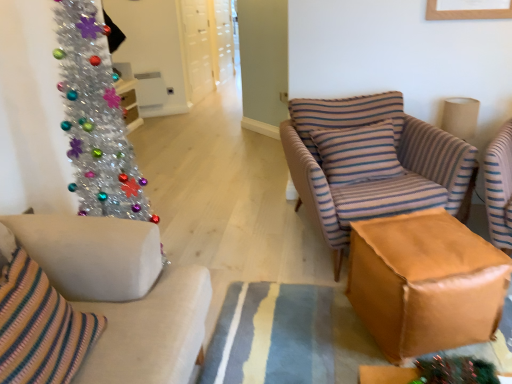
This screenshot has width=512, height=384. What do you see at coordinates (122, 294) in the screenshot?
I see `white fabric couch at left` at bounding box center [122, 294].

This screenshot has width=512, height=384. What are the coordinates of `white fabric couch at left` in the screenshot? It's located at (122, 294).

In order to face brown leather ottoman at center, should I rotate leftwards or rightwards?

Turn right by 20.849 degrees to look at brown leather ottoman at center.

Describe the element at coordinates (358, 153) in the screenshot. I see `striped fabric pillow at center` at that location.

Find the location of a particular element. striped fabric armchair at center is located at coordinates (372, 163).

This screenshot has width=512, height=384. In order to click on white fabric couch at left in this screenshot , I will do `click(122, 294)`.

Which of these two, striped fabric armchair at center or shiny metallic christmas tree at left, is bigger?

With larger size is striped fabric armchair at center.

Where is `rocking chair below the shiny metallic christmas tree at left (from the image's perspective)`? Image resolution: width=512 pixels, height=384 pixels. rocking chair below the shiny metallic christmas tree at left (from the image's perspective) is located at coordinates (372, 163).

Relative to shiny metallic christmas tree at left, is striped fabric armchair at center in front or behind?

striped fabric armchair at center is behind shiny metallic christmas tree at left.

Is striped fabric armchair at center to the left or to the right of shiny metallic christmas tree at left in the image?

Based on their positions, striped fabric armchair at center is located to the right of shiny metallic christmas tree at left.

Is striped fabric pillow at center at the right side of striped fabric armchair at center?

No.

From a real-world perspective, which object stands above the other?

In real-world perspective, striped fabric pillow at center is above.

How distant is striped fabric pillow at center from striped fabric armchair at center?

striped fabric pillow at center is 3.70 inches away from striped fabric armchair at center.

Which point is more distant from viewer, (x=393, y=166) or (x=444, y=145)?

Point (x=393, y=166)

From their relative heights in the image, would you say shiny metallic christmas tree at left is taller or shorter than striped fabric pillow at center?

In the image, shiny metallic christmas tree at left appears to be taller than striped fabric pillow at center.

Considering the positions of objects shiny metallic christmas tree at left and striped fabric pillow at center in the image provided, who is behind, shiny metallic christmas tree at left or striped fabric pillow at center?

Positioned behind is striped fabric pillow at center.

Find the location of a particular element. Image resolution: width=512 pixels, height=384 pixels. christmas tree positioned vertically above the striped fabric pillow at center (from a real-world perspective) is located at coordinates (96, 119).

From the image's perspective, is shiny metallic christmas tree at left below striped fabric pillow at center?

Yes, from the image's perspective, shiny metallic christmas tree at left is below striped fabric pillow at center.

Which object is further away from the camera taking this photo, white fabric couch at left or shiny metallic christmas tree at left?

shiny metallic christmas tree at left is further from the camera.

Would you say shiny metallic christmas tree at left is part of white fabric couch at left's contents?

That's incorrect, shiny metallic christmas tree at left is not inside white fabric couch at left.

From the image's perspective, would you say white fabric couch at left is shown under shiny metallic christmas tree at left?

Correct, white fabric couch at left appears lower than shiny metallic christmas tree at left in the image.

From a real-world perspective, does white fabric couch at left stand above shiny metallic christmas tree at left?

No, from a real-world perspective, white fabric couch at left is not on top of shiny metallic christmas tree at left.

Is white fabric couch at left outside of striped fabric pillow at center?

Absolutely, white fabric couch at left is external to striped fabric pillow at center.

From the picture: Is white fabric couch at left not near striped fabric pillow at center?

white fabric couch at left is far away from striped fabric pillow at center.

Considering the sizes of objects white fabric couch at left and striped fabric pillow at center in the image provided, who is bigger, white fabric couch at left or striped fabric pillow at center?

With larger size is white fabric couch at left.

How different are the orientations of white fabric couch at left and striped fabric pillow at center in degrees?

74.5 degrees.

Is point (100, 223) positioned in front of point (430, 221)?

That is True.

Can you confirm if white fabric couch at left is positioned to the left of brown leather ottoman at center?

Yes.

From the picture: How distant is white fabric couch at left from brown leather ottoman at center?

white fabric couch at left is 89.42 centimeters from brown leather ottoman at center.

Is white fabric couch at left not close to brown leather ottoman at center?

No, white fabric couch at left is not far from brown leather ottoman at center.

Who is bigger, shiny metallic christmas tree at left or white fabric couch at left?

Bigger between the two is white fabric couch at left.

Is point (85, 164) more distant than point (148, 282)?

Yes, point (85, 164) is farther from viewer.

Consider the image. From a real-world perspective, is shiny metallic christmas tree at left above or below white fabric couch at left?

In terms of real-world spatial position, shiny metallic christmas tree at left is above white fabric couch at left.

Does shiny metallic christmas tree at left appear on the right side of white fabric couch at left?

Incorrect, shiny metallic christmas tree at left is not on the right side of white fabric couch at left.

Where is `rocking chair behind the shiny metallic christmas tree at left`? The height and width of the screenshot is (384, 512). rocking chair behind the shiny metallic christmas tree at left is located at coordinates (372, 163).

Find the location of a particular element. rocking chair below the striped fabric pillow at center (from the image's perspective) is located at coordinates (x=372, y=163).

From the image, which object appears to be farther from brown leather ottoman at center, white fabric couch at left or striped fabric pillow at center?

Based on the image, white fabric couch at left appears to be further to brown leather ottoman at center.

Based on their spatial positions, is striped fabric pillow at center or brown leather ottoman at center further from striped fabric armchair at center?

brown leather ottoman at center is further to striped fabric armchair at center.

Looking at the image, which one is located closer to striped fabric armchair at center, white fabric couch at left or shiny metallic christmas tree at left?

shiny metallic christmas tree at left.

Estimate the real-world distances between objects in this image. Which object is closer to white fabric couch at left, brown leather ottoman at center or striped fabric pillow at center?

Among the two, brown leather ottoman at center is located nearer to white fabric couch at left.

From the image, which object appears to be nearer to shiny metallic christmas tree at left, striped fabric armchair at center or brown leather ottoman at center?

Based on the image, brown leather ottoman at center appears to be nearer to shiny metallic christmas tree at left.

Which object lies nearer to the anchor point brown leather ottoman at center, shiny metallic christmas tree at left or white fabric couch at left?

The object closer to brown leather ottoman at center is white fabric couch at left.

Considering their positions, is shiny metallic christmas tree at left positioned further to striped fabric pillow at center than striped fabric armchair at center?

The object further to striped fabric pillow at center is shiny metallic christmas tree at left.

Which object lies further to the anchor point brown leather ottoman at center, striped fabric armchair at center or shiny metallic christmas tree at left?

shiny metallic christmas tree at left is further to brown leather ottoman at center.

Where is `studio couch between shiny metallic christmas tree at left and striped fabric armchair at center`? Image resolution: width=512 pixels, height=384 pixels. studio couch between shiny metallic christmas tree at left and striped fabric armchair at center is located at coordinates (122, 294).

Where is `studio couch between shiny metallic christmas tree at left and brown leather ottoman at center`? studio couch between shiny metallic christmas tree at left and brown leather ottoman at center is located at coordinates (122, 294).

At what (x,y) coordinates should I click in order to perform the action: click on rocking chair between white fabric couch at left and brown leather ottoman at center from left to right. Please return your answer as a coordinate pair (x, y). Looking at the image, I should click on (372, 163).

The width and height of the screenshot is (512, 384). Identify the location of studio couch between shiny metallic christmas tree at left and striped fabric pillow at center from left to right. (122, 294).